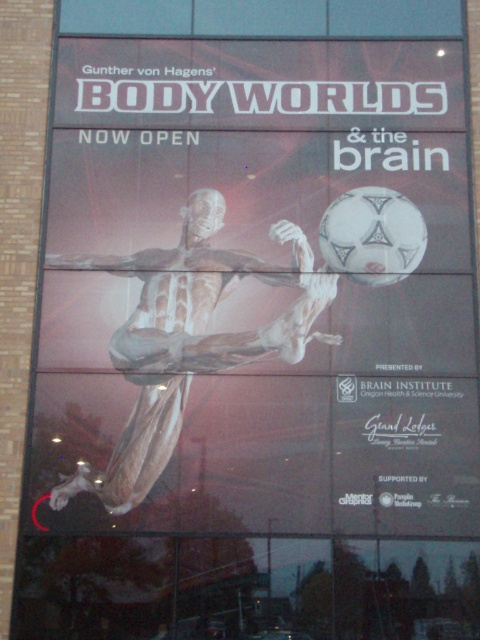
You are a visitor standing in front of the billboard and want to take a photo of both the transparent plastic figure at lower left and the translucent flesh at center. Which object should you focus on first to ensure both are in frame?

The transparent plastic figure at lower left is taller than the translucent flesh at center, so you should focus on the transparent plastic figure at lower left first to ensure both are in frame.

You are standing in front of the BODY WORLDS billboard and want to know how far you are from the point labeled as point (446, 132). Can you determine the distance?

The distance between point (446, 132) and the camera is 45.74 feet, so you are approximately 45.74 feet away from that point.

Looking at this image, you are standing in front of the BODY WORLDS billboard and notice two points marked on it. The first point is at coordinates point (447,374) and the second is at point (317,310). Which of these points appears closer to you?

Point (447,374) is closer to the camera than point (317,310), so the first point appears closer to you.